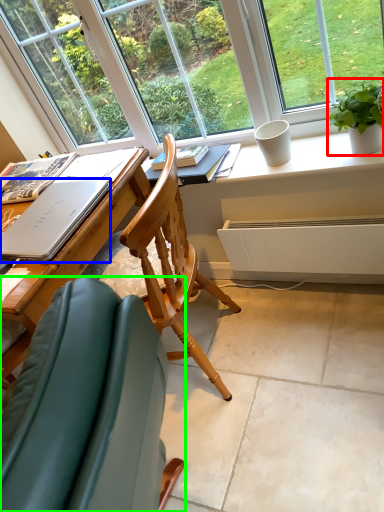
Question: Which is farther away from houseplant (highlighted by a red box)? laptop (highlighted by a blue box) or chair (highlighted by a green box)?

Choices:
 (A) laptop
 (B) chair

Answer: (B)